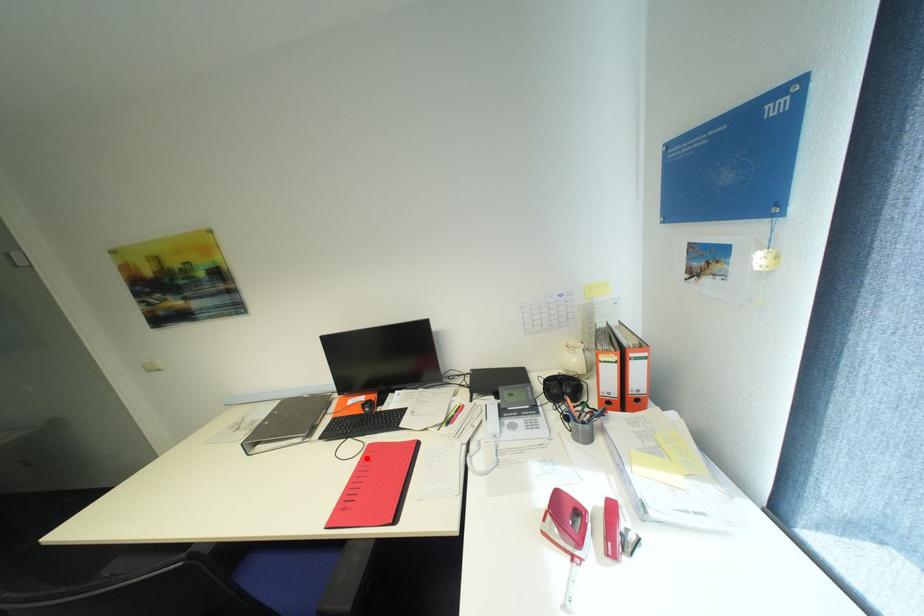
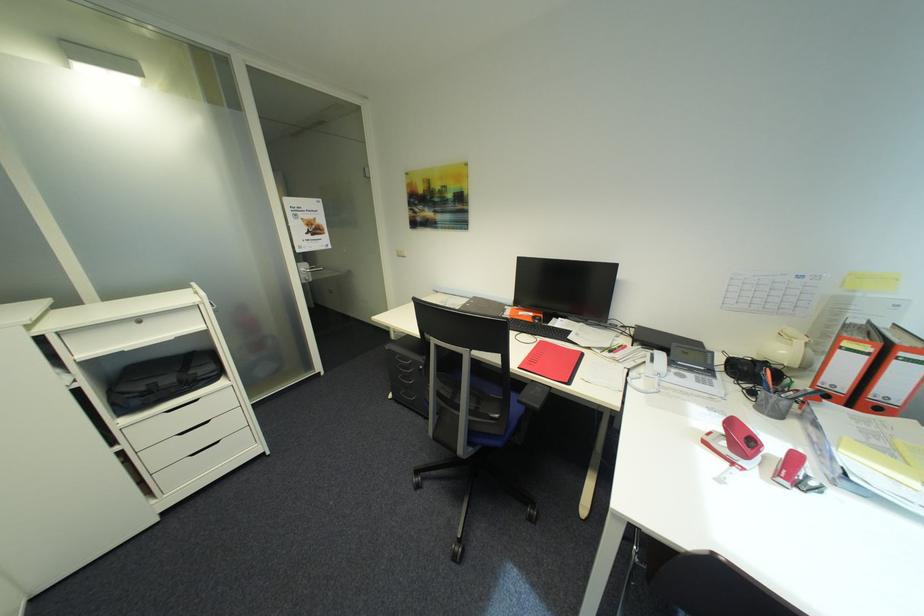
Where in the second image is the point corresponding to the highlighted location from the first image?

(542, 345)